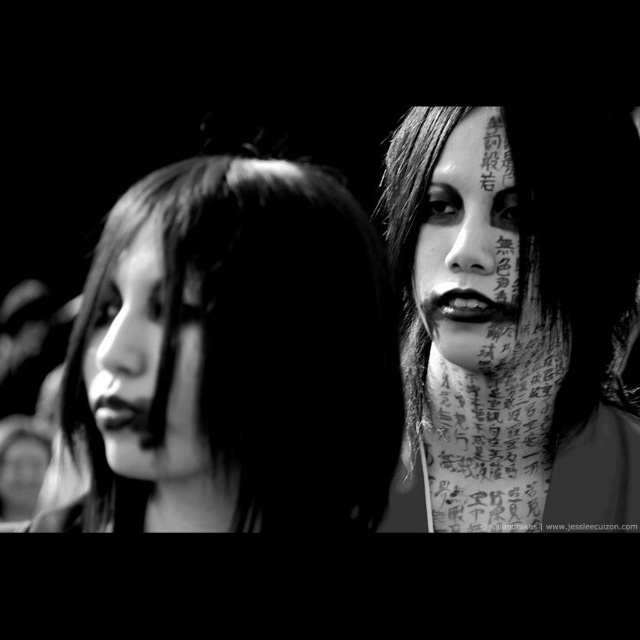
Question: Is smooth skin tattoo at center to the left of smooth skin face at left from the viewer's perspective?

Choices:
 (A) no
 (B) yes

Answer: (A)

Question: Which point is closer to the camera?

Choices:
 (A) (477, 336)
 (B) (225, 333)

Answer: (B)

Question: Based on their relative distances, which object is nearer to the smooth skin tattoo at center?

Choices:
 (A) smooth skin face at upper right
 (B) smooth skin face at center
 (C) smooth skin face at left

Answer: (A)

Question: Can you confirm if smooth skin face at center is smaller than smooth skin tattoo at center?

Choices:
 (A) yes
 (B) no

Answer: (A)

Question: Is smooth skin face at center positioned before smooth skin tattoo at center?

Choices:
 (A) yes
 (B) no

Answer: (A)

Question: Which point is farther to the camera?

Choices:
 (A) smooth skin tattoo at center
 (B) smooth skin face at left

Answer: (A)